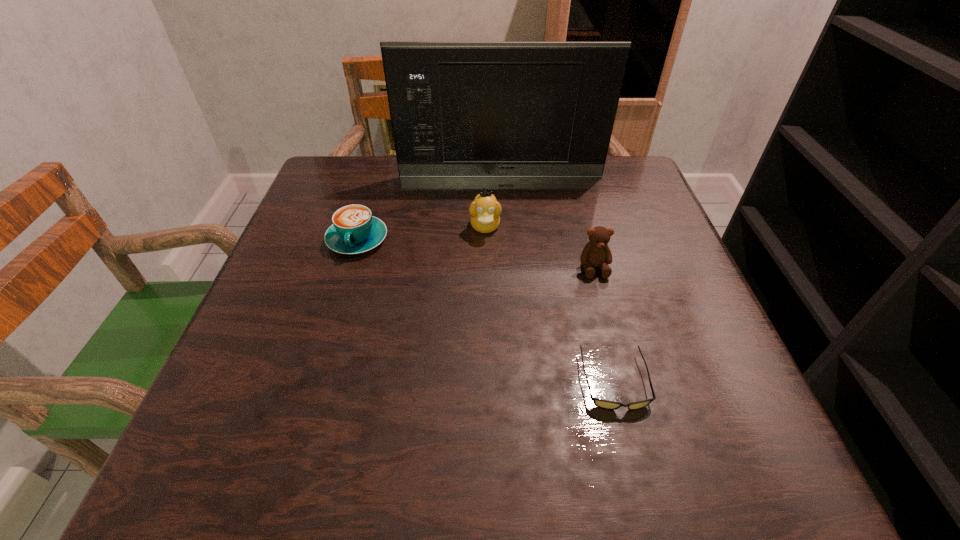
In order to click on the tallest object in this screenshot , I will do `click(458, 109)`.

Identify the location of the farthest object. (458, 109).

The height and width of the screenshot is (540, 960). Find the location of `duckling`. duckling is located at coordinates (485, 210).

Identify the location of teddy bear. (596, 252).

This screenshot has height=540, width=960. I want to click on cappuccino, so click(x=354, y=230).

Locate an element on the screen. This screenshot has width=960, height=540. the nearest object is located at coordinates (605, 404).

Locate an element on the screen. the shortest object is located at coordinates (605, 404).

This screenshot has height=540, width=960. Identify the location of free space located 0.110m on the front panel of the microwave oven. (502, 204).

I want to click on vacant space situated 0.220m on the face of the duckling, so click(487, 320).

Where is `vacant space located 0.210m on the face of the teddy bear`? The image size is (960, 540). vacant space located 0.210m on the face of the teddy bear is located at coordinates (621, 369).